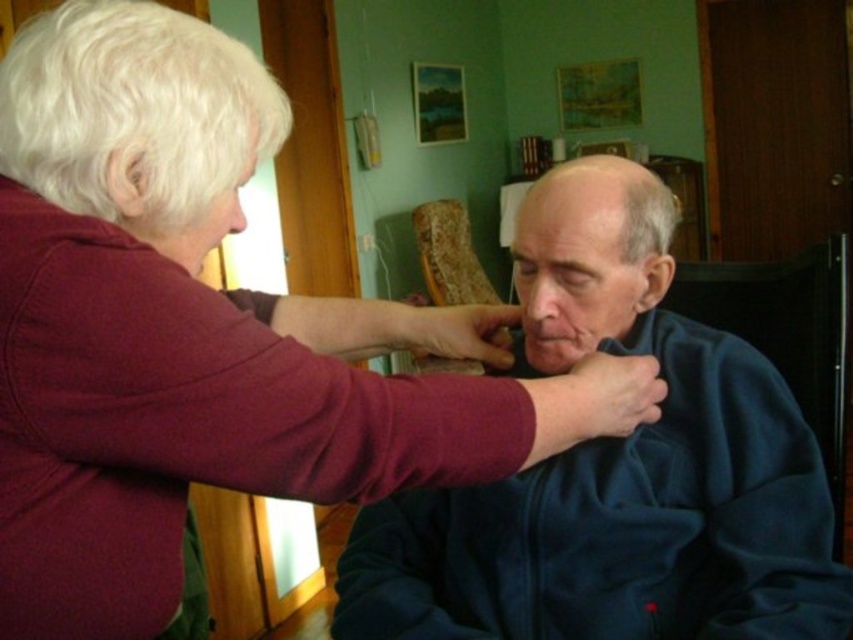
You are a delivery person who needs to deliver a package to the dark blue fleece at center. The package requires a signature from someone within 3 feet. Can the person on the left, who is 5 feet away from you, sign for it?

The distance between you and the person on the left is 5 feet, which is beyond the 3 feet requirement. Therefore, the person on the left cannot sign for the package.

You are a home safety inspector assessing the living room. You see the dark blue fleece at center and the wooden textured chair at center. Which object is taller?

The dark blue fleece at center is taller than the wooden textured chair at center according to the description.

You are a home interior designer assessing the space between the white curly hair at upper left and the wooden textured chair at center. Can you determine which object is shorter?

The white curly hair at upper left has a lesser height compared to wooden textured chair at center, so it is shorter.